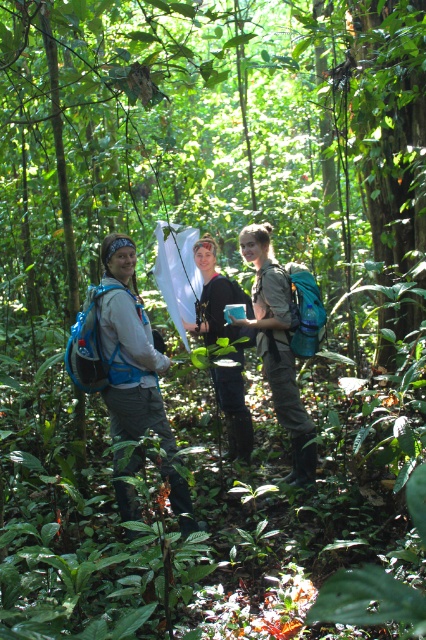
This screenshot has height=640, width=426. What do you see at coordinates (124, 362) in the screenshot? I see `blue fabric backpack at left` at bounding box center [124, 362].

At what (x,y) coordinates should I click in order to perform the action: click on blue fabric backpack at left. Please return your answer as a coordinate pair (x, y). This screenshot has height=640, width=426. Looking at the image, I should click on (124, 362).

From the picture: Is the position of blue fabric backpack at left more distant than that of matte blue backpack at center?

No, blue fabric backpack at left is in front of matte blue backpack at center.

In the scene shown: Who is higher up, blue fabric backpack at left or matte blue backpack at center?

matte blue backpack at center is higher up.

Who is more forward, [117,339] or [279,406]?

Positioned in front is point [117,339].

Where is `blue fabric backpack at left`? This screenshot has height=640, width=426. blue fabric backpack at left is located at coordinates (124, 362).

Is matte blue backpack at left in front of matte blue backpack at center?

Yes, matte blue backpack at left is closer to the viewer.

You are a GUI agent. You are given a task and a screenshot of the screen. Output one action in this format:
    pyautogui.click(x=<x>, y=<y>)
    Task: Click on the matte blue backpack at left
    
    Given the screenshot: What is the action you would take?
    pyautogui.click(x=135, y=368)